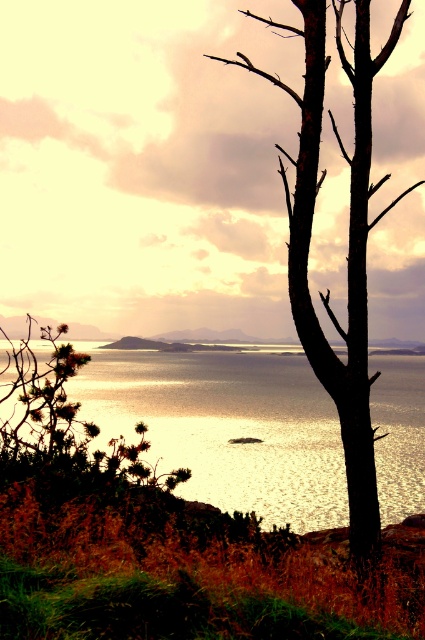
Question: Is glistening reflective water at center thinner than black bark tree at right?

Choices:
 (A) yes
 (B) no

Answer: (A)

Question: Is glistening reflective water at center positioned at the back of black bark tree at right?

Choices:
 (A) yes
 (B) no

Answer: (A)

Question: Can you confirm if glistening reflective water at center is positioned to the left of black bark tree at right?

Choices:
 (A) no
 (B) yes

Answer: (A)

Question: Which of the following is the farthest from the observer?

Choices:
 (A) (226, 428)
 (B) (340, 385)

Answer: (A)

Question: Among these points, which one is nearest to the camera?

Choices:
 (A) (365, 157)
 (B) (384, 483)

Answer: (A)